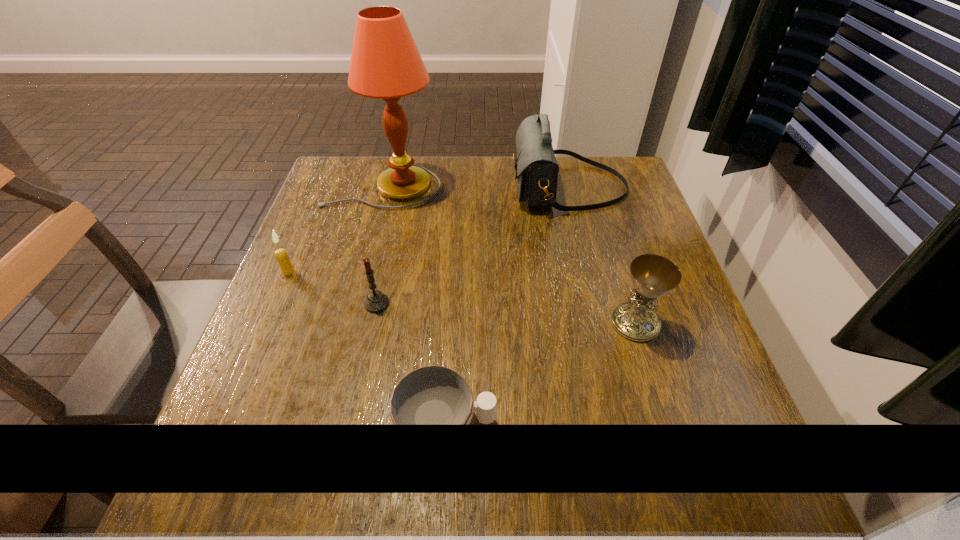
Find the location of a particular element. The height and width of the screenshot is (540, 960). free space between the chalice and the tallest object is located at coordinates (509, 255).

Find the location of a particular element. blank region between the nearer candle and the chalice is located at coordinates (506, 313).

You are a GUI agent. You are given a task and a screenshot of the screen. Output one action in this format:
    pyautogui.click(x=<x>, y=<y>)
    Task: Click on the vacant point located between the second tallest object and the lamp
    The image size is (960, 540).
    Given the screenshot: What is the action you would take?
    point(475,186)

Where is `free space that is in between the chalice and the second tallest object`? This screenshot has height=540, width=960. free space that is in between the chalice and the second tallest object is located at coordinates (602, 254).

Where is `vacant region between the shoulder bag and the chalice`? vacant region between the shoulder bag and the chalice is located at coordinates coord(602,254).

You are a GUI agent. You are given a task and a screenshot of the screen. Output one action in this format:
    pyautogui.click(x=<x>, y=<y>)
    Task: Click on the empty space that is in between the fourth nearest object and the chalice
    The width and height of the screenshot is (960, 540).
    Given the screenshot: What is the action you would take?
    pyautogui.click(x=462, y=298)

Where is `free space between the lamp and the shortest object`? free space between the lamp and the shortest object is located at coordinates (414, 305).

Identify the location of vacant space that is in between the second tallest object and the chalice. (602, 254).

Find the location of a particular element. The image size is (960, 540). empty space that is in between the right candle and the second tallest object is located at coordinates [472, 245].

Identify which object is located as the fifth nearest to the farther candle. Please provide its 2D coordinates. Your answer should be formatted as a tuple, i.e. [(x, y)], where the tuple contains the x and y coordinates of a point satisfying the conditions above.

[(653, 276)]